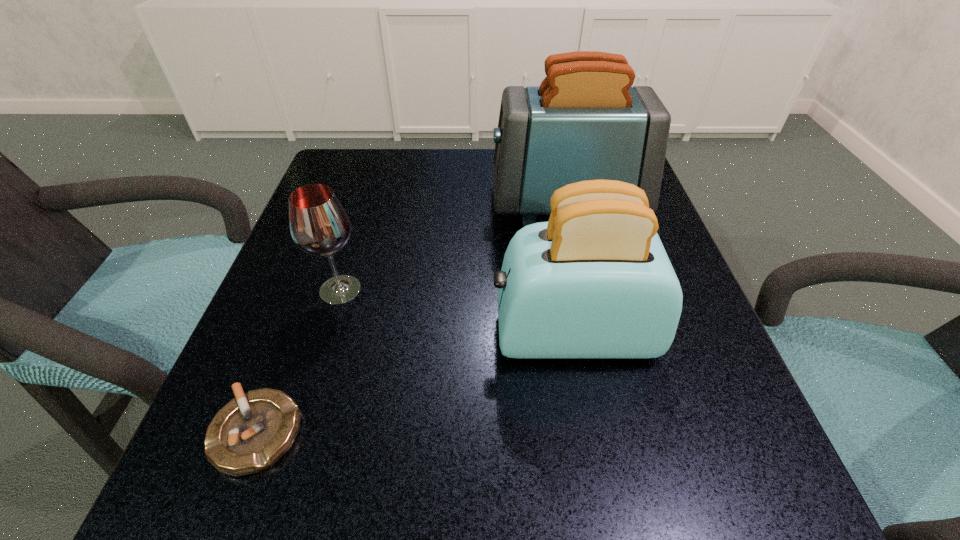
Identify which object is located as the nearest to the nearer toaster. Please provide its 2D coordinates. Your answer should be formatted as a tuple, i.e. [(x, y)], where the tuple contains the x and y coordinates of a point satisfying the conditions above.

[(584, 122)]

The width and height of the screenshot is (960, 540). I want to click on object that stands as the closest to the nearer toaster, so click(584, 122).

Identify the location of blank space that satisfies the following two spatial constraints: 1. on the front-facing side of the farthest object; 2. on the front side of the second shortest object. (586, 290).

You are a GUI agent. You are given a task and a screenshot of the screen. Output one action in this format:
    pyautogui.click(x=<x>, y=<y>)
    Task: Click on the free region that satisfies the following two spatial constraints: 1. on the front-facing side of the farthest object; 2. on the front side of the shortest object
    
    Given the screenshot: What is the action you would take?
    pyautogui.click(x=619, y=433)